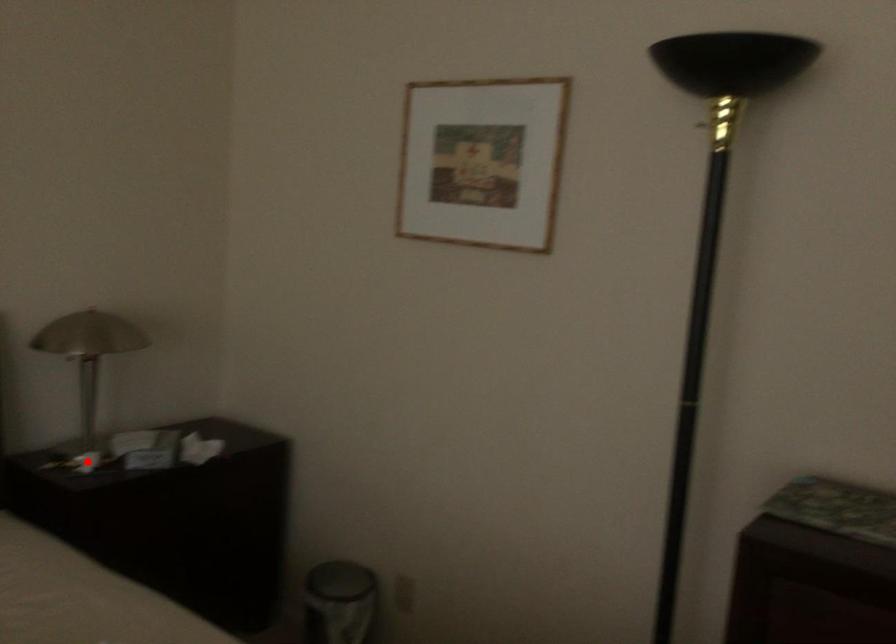
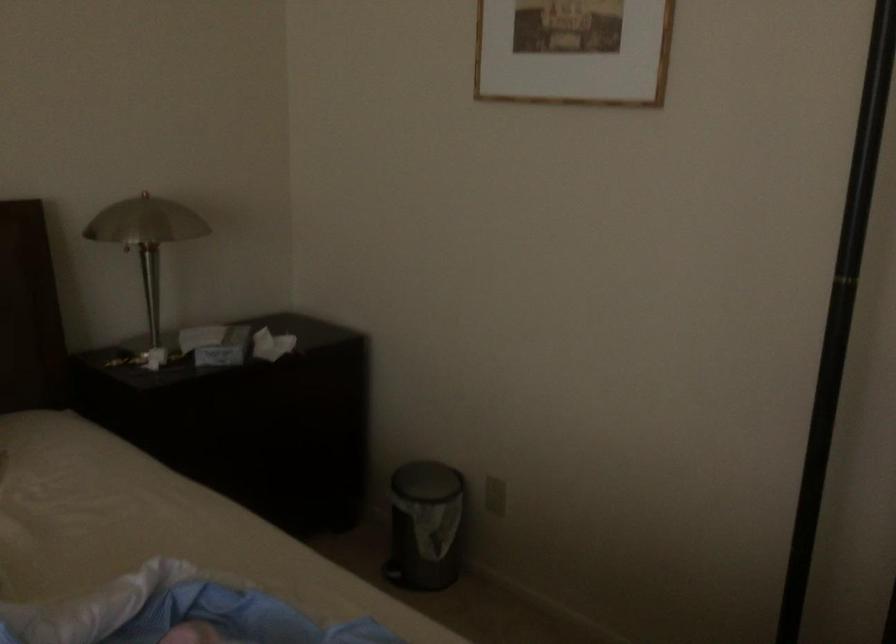
The point at the highlighted location is marked in the first image. Where is the corresponding point in the second image?

(151, 357)